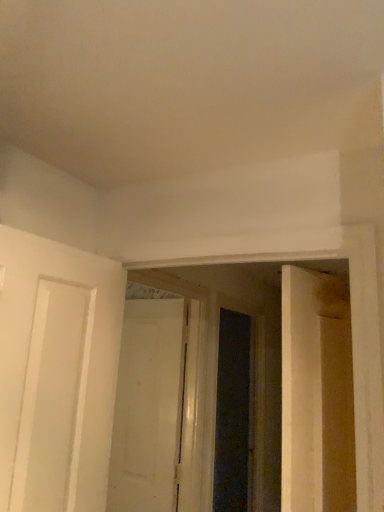
Measure the distance between point (225,385) and camera.

The distance of point (225,385) from camera is 12.28 feet.

What is the approximate width of transparent glass screen door at center?

5.02 inches.

What are the coordinates of `transparent glass screen door at center` in the screenshot? It's located at (233, 415).

What do you see at coordinates (233, 415) in the screenshot? I see `transparent glass screen door at center` at bounding box center [233, 415].

Identify the location of white matte door at center. (146, 408).

The image size is (384, 512). What do you see at coordinates (146, 408) in the screenshot?
I see `white matte door at center` at bounding box center [146, 408].

What is the approximate width of white matte door at center?

It is 6.46 centimeters.

Locate an element on the screen. transparent glass screen door at center is located at coordinates (233, 415).

Which object is positioned more to the right, transparent glass screen door at center or white matte door at center?

Positioned to the right is transparent glass screen door at center.

Looking at this image, considering the positions of objects transparent glass screen door at center and white matte door at center in the image provided, who is in front, transparent glass screen door at center or white matte door at center?

white matte door at center is closer to the camera.

Is point (251, 425) in front of point (168, 450)?

No, (251, 425) is behind (168, 450).

From the image's perspective, which is below, transparent glass screen door at center or white matte door at center?

transparent glass screen door at center appears lower in the image.

From a real-world perspective, between transparent glass screen door at center and white matte door at center, who is vertically lower?

transparent glass screen door at center is physically lower.

Between transparent glass screen door at center and white matte door at center, which one has larger width?

With larger width is transparent glass screen door at center.

Considering the relative sizes of transparent glass screen door at center and white matte door at center in the image provided, is transparent glass screen door at center shorter than white matte door at center?

In fact, transparent glass screen door at center may be taller than white matte door at center.

Looking at the image, does transparent glass screen door at center seem bigger or smaller compared to white matte door at center?

In the image, transparent glass screen door at center appears to be larger than white matte door at center.

Is transparent glass screen door at center outside of white matte door at center?

Indeed, transparent glass screen door at center is completely outside white matte door at center.

Is transparent glass screen door at center directly adjacent to white matte door at center?

transparent glass screen door at center is not next to white matte door at center, and they're not touching.

Is transparent glass screen door at center facing away from white matte door at center?

No, transparent glass screen door at center is not facing the opposite direction of white matte door at center.

Can you tell me how much transparent glass screen door at center and white matte door at center differ in facing direction?

The angular difference between transparent glass screen door at center and white matte door at center is 91.4 degrees.

I want to click on screen door behind the white matte door at center, so click(233, 415).

Considering the relative positions of white matte door at center and transparent glass screen door at center in the image provided, is white matte door at center to the right of transparent glass screen door at center from the viewer's perspective?

No.

Is white matte door at center positioned behind transparent glass screen door at center?

No, it is not.

Which is in front, point (160, 362) or point (239, 434)?

The point (160, 362) is closer to the camera.

From the image's perspective, is white matte door at center located above transparent glass screen door at center?

Yes, from the image's perspective, white matte door at center is over transparent glass screen door at center.

From a real-world perspective, which object rests below the other?

transparent glass screen door at center.

Consider the image. Is white matte door at center wider than transparent glass screen door at center?

No.

Consider the image. Considering the relative sizes of white matte door at center and transparent glass screen door at center in the image provided, is white matte door at center shorter than transparent glass screen door at center?

Yes, white matte door at center is shorter than transparent glass screen door at center.

Considering the sizes of objects white matte door at center and transparent glass screen door at center in the image provided, who is smaller, white matte door at center or transparent glass screen door at center?

With smaller size is white matte door at center.

Consider the image. Is white matte door at center spatially inside transparent glass screen door at center, or outside of it?

white matte door at center lies outside transparent glass screen door at center.

Does white matte door at center touch transparent glass screen door at center?

No, white matte door at center is not in contact with transparent glass screen door at center.

Is white matte door at center turned away from transparent glass screen door at center?

Absolutely, white matte door at center is directed away from transparent glass screen door at center.

You are a GUI agent. You are given a task and a screenshot of the screen. Output one action in this format:
    pyautogui.click(x=<x>, y=<y>)
    Task: Click on the door above the transparent glass screen door at center (from a real-world perspective)
    This screenshot has height=512, width=384.
    Given the screenshot: What is the action you would take?
    pyautogui.click(x=146, y=408)

Identify the location of door above the transparent glass screen door at center (from a real-world perspective). (146, 408).

Locate an element on the screen. This screenshot has height=512, width=384. door above the transparent glass screen door at center (from the image's perspective) is located at coordinates (146, 408).